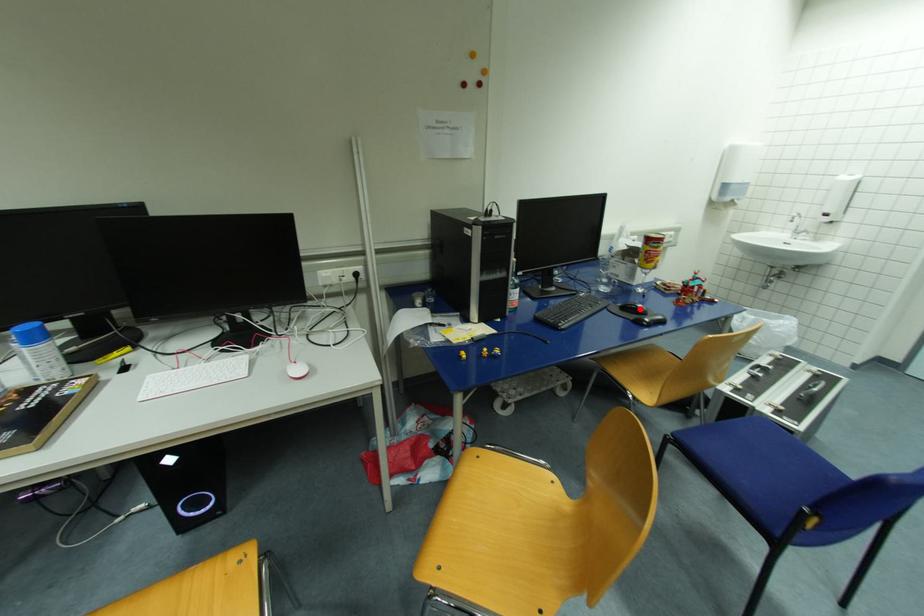
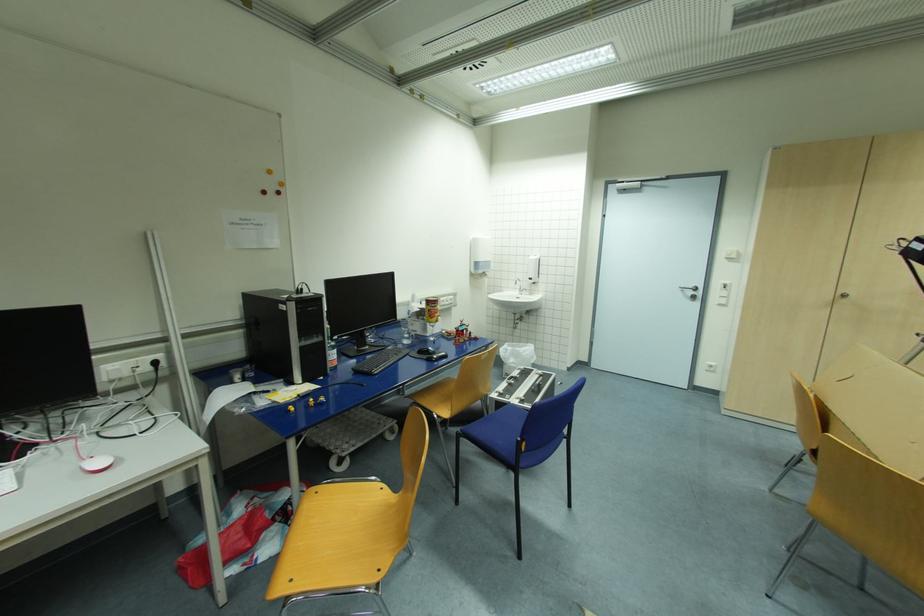
Locate, in the second image, the point that corresponds to the highlighted location in the first image.

(432, 351)